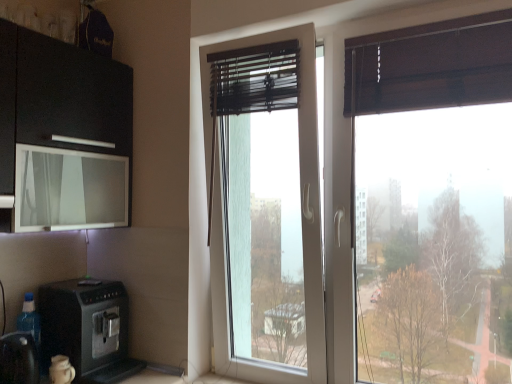
This screenshot has height=384, width=512. I want to click on empty space that is ontop of transparent glass window at center, so click(259, 46).